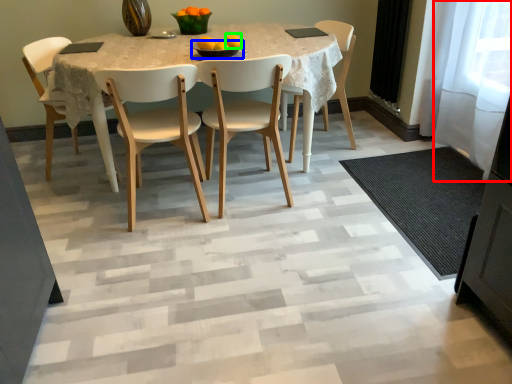
Question: Which object is positioned closest to glass door (highlighted by a red box)? Select from bowl (highlighted by a blue box) and orange (highlighted by a green box).

Choices:
 (A) bowl
 (B) orange

Answer: (B)